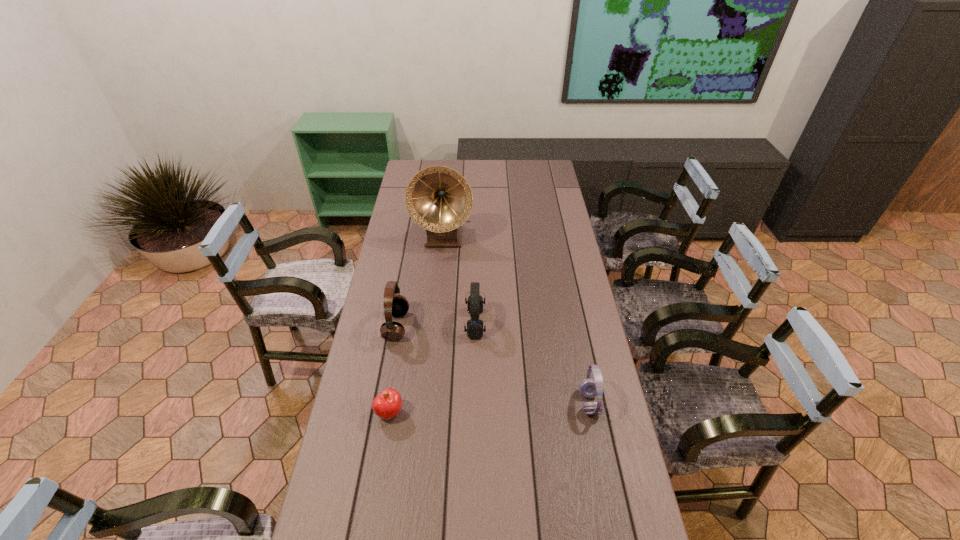
This screenshot has width=960, height=540. In order to click on vacant space at the right edge of the desktop in this screenshot , I will do `click(566, 258)`.

What are the coordinates of `blank area at the far left corner` in the screenshot? It's located at (416, 164).

Where is `free spot between the farthest object and the second headset from left to right`? The height and width of the screenshot is (540, 960). free spot between the farthest object and the second headset from left to right is located at coordinates (459, 280).

Identify the location of unoccupied position between the shortest object and the phonograph record. (417, 325).

You are a GUI agent. You are given a task and a screenshot of the screen. Output one action in this format:
    pyautogui.click(x=<x>, y=<y>)
    Task: Click on the vacant area that lies between the shortest object and the tallest object
    
    Given the screenshot: What is the action you would take?
    pyautogui.click(x=417, y=325)

Locate an element on the screen. Image resolution: width=960 pixels, height=540 pixels. free area in between the leftmost headset and the second headset from right to left is located at coordinates (436, 325).

You are a GUI agent. You are given a task and a screenshot of the screen. Output one action in this format:
    pyautogui.click(x=<x>, y=<y>)
    Task: Click on the unoccupied position between the apple and the tallest object
    The height and width of the screenshot is (540, 960).
    Given the screenshot: What is the action you would take?
    pyautogui.click(x=417, y=325)

Where is `free space between the nearest headset and the second headset from left to right`? free space between the nearest headset and the second headset from left to right is located at coordinates (532, 363).

Where is `free space between the leftmost headset and the second headset from right to left`? free space between the leftmost headset and the second headset from right to left is located at coordinates (436, 325).

Image resolution: width=960 pixels, height=540 pixels. What are the coordinates of `vacant area between the apple and the second headset from left to right` in the screenshot? It's located at (432, 368).